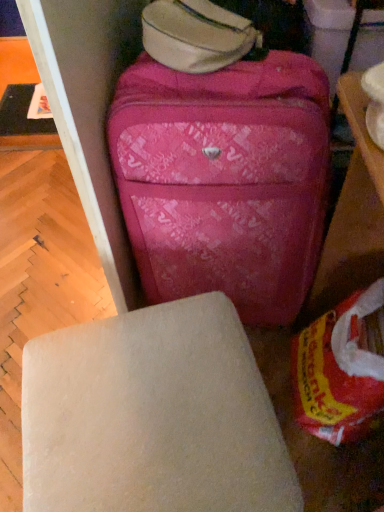
Find the location of `matte white table at upper right, the first table positioned from the front`. matte white table at upper right, the first table positioned from the front is located at coordinates (361, 126).

At what (x,y) coordinates should I click in order to perform the action: click on black plastic table at upper left, marked as the second table in a front-to-back arrangement. Please return your answer as a coordinate pair (x, y). Looking at the image, I should click on (24, 121).

The width and height of the screenshot is (384, 512). Identify the location of matte white table at upper right, the first table positioned from the front. (x=361, y=126).

Can you see black plastic table at upper left, which appears as the 1th table when viewed from the back, touching matte white table at upper right, the first table positioned from the front?

black plastic table at upper left, which appears as the 1th table when viewed from the back, and matte white table at upper right, the first table positioned from the front, are not in contact.

Considering their positions, is black plastic table at upper left, the first table when ordered from left to right, located in front of or behind matte white table at upper right, the first table positioned from the front?

Clearly, black plastic table at upper left, the first table when ordered from left to right, is behind matte white table at upper right, the first table positioned from the front.

Consider the image. In terms of width, does black plastic table at upper left, the first table when ordered from left to right, look wider or thinner when compared to matte white table at upper right, arranged as the second table when viewed from the left?

black plastic table at upper left, the first table when ordered from left to right, is wider than matte white table at upper right, arranged as the second table when viewed from the left.

At what (x,y) coordinates should I click in order to perform the action: click on table on the left of the matte white table at upper right, placed as the first table when sorted from right to left. Please return your answer as a coordinate pair (x, y). Image resolution: width=384 pixels, height=512 pixels. Looking at the image, I should click on (24, 121).

Between pink fabric suitcase at center and black plastic table at upper left, marked as the second table in a front-to-back arrangement, which one has smaller width?

Thinner between the two is pink fabric suitcase at center.

From the image's perspective, is pink fabric suitcase at center above black plastic table at upper left, marked as the second table in a right-to-left arrangement?

No, from the image's perspective, pink fabric suitcase at center is not above black plastic table at upper left, marked as the second table in a right-to-left arrangement.

Is black plastic table at upper left, marked as the second table in a front-to-back arrangement, a part of pink fabric suitcase at center?

Definitely not — black plastic table at upper left, marked as the second table in a front-to-back arrangement, is not inside pink fabric suitcase at center.

Measure the distance from pink fabric suitcase at center to black plastic table at upper left, which is the first table in top-to-bottom order.

A distance of 1.12 meters exists between pink fabric suitcase at center and black plastic table at upper left, which is the first table in top-to-bottom order.

Is black plastic table at upper left, marked as the second table in a right-to-left arrangement, situated inside white matte stool at center or outside?

The correct answer is: outside.

From a real-world perspective, does black plastic table at upper left, the first table when ordered from left to right, sit lower than white matte stool at center?

Yes, from a real-world perspective, black plastic table at upper left, the first table when ordered from left to right, is beneath white matte stool at center.

Considering the relative sizes of black plastic table at upper left, which appears as the 1th table when viewed from the back, and white matte stool at center in the image provided, is black plastic table at upper left, which appears as the 1th table when viewed from the back, taller than white matte stool at center?

No, black plastic table at upper left, which appears as the 1th table when viewed from the back, is not taller than white matte stool at center.

Image resolution: width=384 pixels, height=512 pixels. I want to click on furniture in front of the black plastic table at upper left, marked as the second table in a right-to-left arrangement, so click(x=152, y=416).

Are pink fabric suitcase at center and white matte stool at center located far from each other?

No, there isn't a large distance between pink fabric suitcase at center and white matte stool at center.

Is white matte stool at center a part of pink fabric suitcase at center?

No, pink fabric suitcase at center does not contain white matte stool at center.

Can you confirm if pink fabric suitcase at center is smaller than white matte stool at center?

Incorrect, pink fabric suitcase at center is not smaller in size than white matte stool at center.

Which is closer, (8, 119) or (216, 165)?

Point (8, 119) is farther from the camera than point (216, 165).

From a real-world perspective, which object rests below the other?

In real-world perspective, black plastic table at upper left, marked as the second table in a right-to-left arrangement, is lower.

Does black plastic table at upper left, marked as the second table in a front-to-back arrangement, contain pink fabric suitcase at center?

No, pink fabric suitcase at center is not a part of black plastic table at upper left, marked as the second table in a front-to-back arrangement.

Is black plastic table at upper left, the first table when ordered from left to right, oriented away from pink fabric suitcase at center?

black plastic table at upper left, the first table when ordered from left to right, does not have its back to pink fabric suitcase at center.

Is point (288, 498) positioned after point (355, 116)?

That is False.

How distant is white matte stool at center from matte white table at upper right, arranged as the second table when viewed from the left?

They are 20.83 inches apart.

Considering the sizes of objects white matte stool at center and matte white table at upper right, which is the second table from back to front, in the image provided, who is thinner, white matte stool at center or matte white table at upper right, which is the second table from back to front,?

Thinner between the two is matte white table at upper right, which is the second table from back to front.

Which is more to the left, white matte stool at center or matte white table at upper right, placed as the first table when sorted from right to left?

Positioned to the left is white matte stool at center.

Is matte white table at upper right, placed as the first table when sorted from right to left, further to the viewer compared to white matte stool at center?

No, matte white table at upper right, placed as the first table when sorted from right to left, is in front of white matte stool at center.

How different are the orientations of matte white table at upper right, placed as the first table when sorted from right to left, and white matte stool at center in degrees?

matte white table at upper right, placed as the first table when sorted from right to left, and white matte stool at center are facing 10.7 degrees away from each other.

From a real-world perspective, is matte white table at upper right, marked as the second table in a top-to-bottom arrangement, over white matte stool at center?

Yes, from a real-world perspective, matte white table at upper right, marked as the second table in a top-to-bottom arrangement, is on top of white matte stool at center.

Identify the location of table above the black plastic table at upper left, marked as the second table in a right-to-left arrangement (from a real-world perspective). Image resolution: width=384 pixels, height=512 pixels. (361, 126).

Find the location of `suitcase located in front of the black plastic table at upper left, the first table when ordered from left to right`. suitcase located in front of the black plastic table at upper left, the first table when ordered from left to right is located at coordinates 224,180.

Looking at the image, which one is located closer to pink fabric suitcase at center, matte white table at upper right, placed as the first table when sorted from right to left, or black plastic table at upper left, the first table when ordered from left to right?

matte white table at upper right, placed as the first table when sorted from right to left, lies closer to pink fabric suitcase at center than the other object.

Which object lies further to the anchor point white matte stool at center, black plastic table at upper left, marked as the second table in a right-to-left arrangement, or pink fabric suitcase at center?

The object further to white matte stool at center is black plastic table at upper left, marked as the second table in a right-to-left arrangement.

Looking at the image, which one is located closer to white matte stool at center, matte white table at upper right, acting as the 1th table starting from the bottom, or pink fabric suitcase at center?

Based on the image, pink fabric suitcase at center appears to be nearer to white matte stool at center.

Estimate the real-world distances between objects in this image. Which object is further from matte white table at upper right, the first table positioned from the front, pink fabric suitcase at center or black plastic table at upper left, marked as the second table in a right-to-left arrangement?

The object further to matte white table at upper right, the first table positioned from the front, is black plastic table at upper left, marked as the second table in a right-to-left arrangement.

Based on their spatial positions, is white matte stool at center or black plastic table at upper left, which is the first table in top-to-bottom order, closer to matte white table at upper right, acting as the 1th table starting from the bottom?

The object closer to matte white table at upper right, acting as the 1th table starting from the bottom, is white matte stool at center.

Considering their positions, is white matte stool at center positioned closer to black plastic table at upper left, which is the first table in top-to-bottom order, than pink fabric suitcase at center?

pink fabric suitcase at center is positioned closer to the anchor black plastic table at upper left, which is the first table in top-to-bottom order.

Consider the image. Which object lies nearer to the anchor point black plastic table at upper left, marked as the second table in a right-to-left arrangement, matte white table at upper right, the first table positioned from the front, or pink fabric suitcase at center?

The object closer to black plastic table at upper left, marked as the second table in a right-to-left arrangement, is pink fabric suitcase at center.

Considering their positions, is pink fabric suitcase at center positioned further to matte white table at upper right, which is the second table from back to front, than white matte stool at center?

Among the two, white matte stool at center is located further to matte white table at upper right, which is the second table from back to front.

Locate an element on the screen. suitcase between white matte stool at center and black plastic table at upper left, marked as the second table in a front-to-back arrangement, in the front-back direction is located at coordinates (224, 180).

In order to click on suitcase between matte white table at upper right, arranged as the second table when viewed from the left, and white matte stool at center from top to bottom in this screenshot , I will do `click(224, 180)`.

The height and width of the screenshot is (512, 384). What are the coordinates of `furniture located between matte white table at upper right, the first table positioned from the front, and black plastic table at upper left, which appears as the 1th table when viewed from the back, in the depth direction` in the screenshot? It's located at (152, 416).

This screenshot has height=512, width=384. What are the coordinates of `suitcase between matte white table at upper right, the first table positioned from the front, and black plastic table at upper left, which ranks as the 2th table in bottom-to-top order, along the z-axis` in the screenshot? It's located at (224, 180).